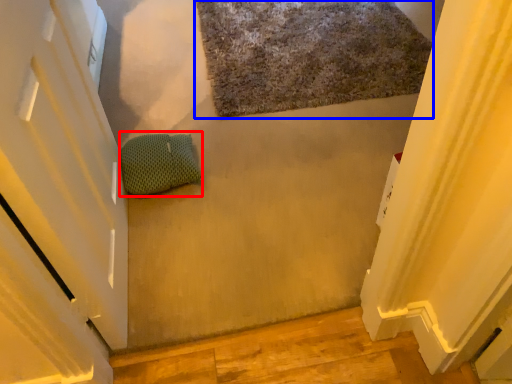
Question: Among these objects, which one is nearest to the camera, pillow (highlighted by a red box) or bath mat (highlighted by a blue box)?

Choices:
 (A) pillow
 (B) bath mat

Answer: (A)